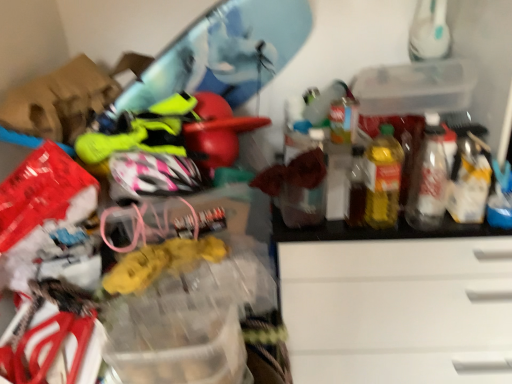
Question: Can you confirm if yellow translucent bottle at right, which ranks as the 1th bottle in left-to-right order, is taller than transparent plastic storage box at upper right?

Choices:
 (A) yes
 (B) no

Answer: (A)

Question: Is yellow translucent bottle at right, which is the second bottle from right to left, bigger than transparent plastic storage box at upper right?

Choices:
 (A) yes
 (B) no

Answer: (B)

Question: Can you confirm if yellow translucent bottle at right, which is the second bottle from right to left, is positioned to the right of transparent plastic storage box at upper right?

Choices:
 (A) no
 (B) yes

Answer: (A)

Question: Is yellow translucent bottle at right, which ranks as the 1th bottle in left-to-right order, to the left of transparent plastic storage box at upper right from the viewer's perspective?

Choices:
 (A) yes
 (B) no

Answer: (A)

Question: From a real-world perspective, is yellow translucent bottle at right, which is the second bottle from right to left, below transparent plastic storage box at upper right?

Choices:
 (A) no
 (B) yes

Answer: (B)

Question: Is point (395, 162) positioned closer to the camera than point (450, 59)?

Choices:
 (A) closer
 (B) farther

Answer: (A)

Question: Would you say yellow translucent bottle at right, which is the second bottle from right to left, is inside or outside transparent plastic storage box at upper right?

Choices:
 (A) outside
 (B) inside

Answer: (A)

Question: From a real-world perspective, is yellow translucent bottle at right, which ranks as the 1th bottle in left-to-right order, physically located above or below transparent plastic storage box at upper right?

Choices:
 (A) above
 (B) below

Answer: (B)

Question: Is yellow translucent bottle at right, which ranks as the 1th bottle in left-to-right order, taller or shorter than transparent plastic storage box at upper right?

Choices:
 (A) short
 (B) tall

Answer: (B)

Question: From a real-world perspective, is translucent plastic bottle at right, which is counted as the 1th bottle, starting from the right, positioned above or below yellow translucent bottle at right, which is the second bottle from right to left?

Choices:
 (A) above
 (B) below

Answer: (B)

Question: Is translucent plastic bottle at right, positioned as the second bottle in left-to-right order, in front of or behind yellow translucent bottle at right, which is the second bottle from right to left, in the image?

Choices:
 (A) behind
 (B) front

Answer: (A)

Question: Considering the positions of point click(415, 216) and point click(364, 165), is point click(415, 216) closer or farther from the camera than point click(364, 165)?

Choices:
 (A) closer
 (B) farther

Answer: (B)

Question: Looking at the image, does translucent plastic bottle at right, which is counted as the 1th bottle, starting from the right, seem bigger or smaller compared to yellow translucent bottle at right, which is the second bottle from right to left?

Choices:
 (A) big
 (B) small

Answer: (B)

Question: Is point (397, 175) closer or farther from the camera than point (417, 177)?

Choices:
 (A) farther
 (B) closer

Answer: (B)

Question: In the image, is yellow translucent bottle at right, which ranks as the 1th bottle in left-to-right order, positioned in front of or behind translucent plastic bottle at right, which is counted as the 1th bottle, starting from the right?

Choices:
 (A) behind
 (B) front

Answer: (B)